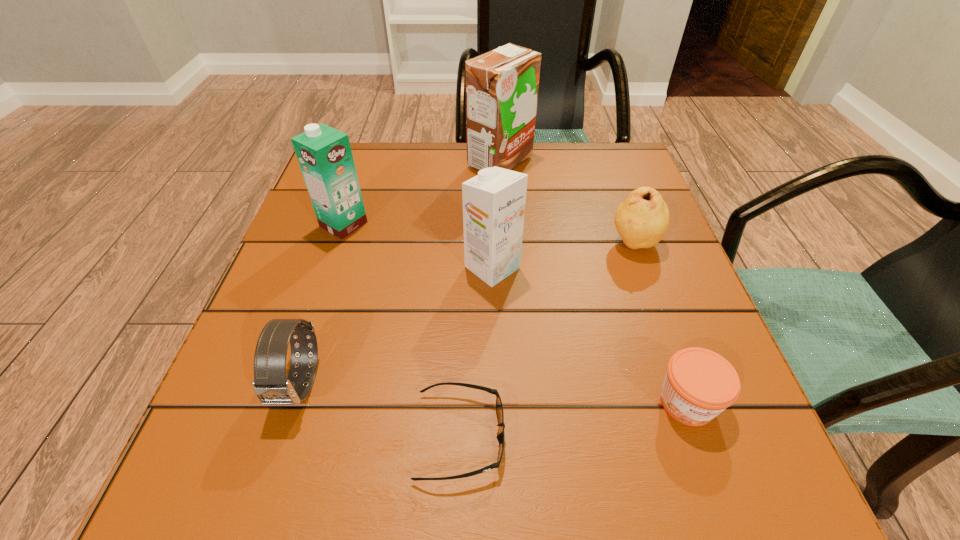
The width and height of the screenshot is (960, 540). Find the location of `vacant area that lies between the sixth tallest object and the nearest carton`. vacant area that lies between the sixth tallest object and the nearest carton is located at coordinates (589, 335).

Locate an element on the screen. free spot between the nearest carton and the shortest object is located at coordinates (476, 352).

This screenshot has height=540, width=960. What are the coordinates of `free spot between the nearest carton and the shortest object` in the screenshot? It's located at (476, 352).

This screenshot has width=960, height=540. What are the coordinates of `vacant area that lies between the second nearest carton and the nearest carton` in the screenshot? It's located at (418, 246).

This screenshot has height=540, width=960. I want to click on free area in between the jam and the nearest carton, so coord(589,335).

The width and height of the screenshot is (960, 540). I want to click on vacant space that's between the jam and the leftmost carton, so click(x=516, y=313).

Find the location of a particular element. The image size is (960, 540). free point between the watch and the tallest object is located at coordinates (400, 272).

Locate an element on the screen. Image resolution: width=960 pixels, height=540 pixels. empty space that is in between the watch and the pear is located at coordinates (468, 313).

I want to click on object that is the closest to the shortest object, so click(x=271, y=386).

Locate an element on the screen. The image size is (960, 540). object that is the closest to the nearest carton is located at coordinates (641, 220).